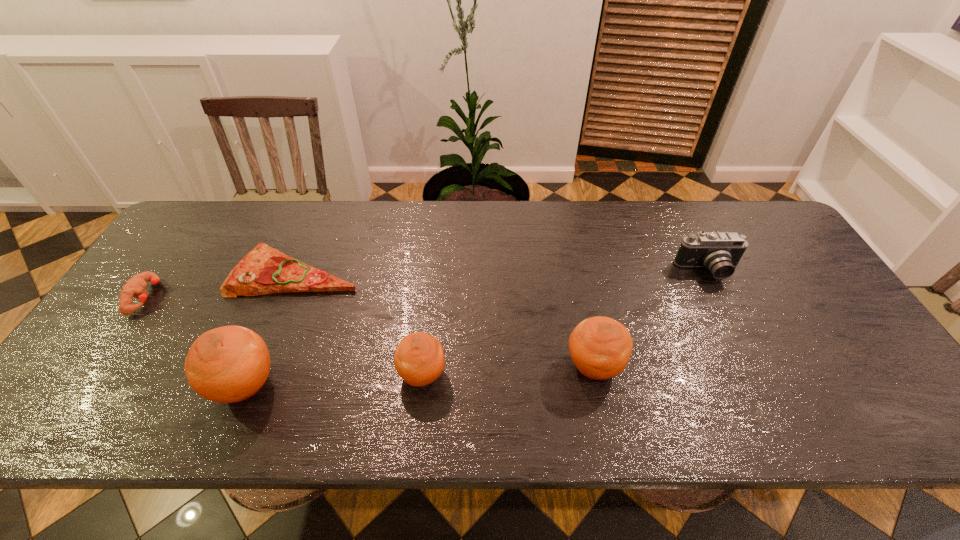
Where is `the leftmost orange`? The image size is (960, 540). the leftmost orange is located at coordinates (229, 364).

The width and height of the screenshot is (960, 540). Identify the location of the fourth object from left to right. (419, 360).

The width and height of the screenshot is (960, 540). I want to click on the second orange from left to right, so click(419, 360).

Image resolution: width=960 pixels, height=540 pixels. I want to click on the fifth shortest object, so click(600, 347).

Identify the location of the second shortest orange. This screenshot has height=540, width=960. pos(600,347).

This screenshot has height=540, width=960. I want to click on puncher, so click(135, 287).

This screenshot has height=540, width=960. Identify the location of the second shortest object. (135, 287).

Where is `the shortest object`? This screenshot has width=960, height=540. the shortest object is located at coordinates (264, 270).

I want to click on the rightmost object, so click(719, 252).

Where is `blank area located on the back of the leftmost orange`? Image resolution: width=960 pixels, height=540 pixels. blank area located on the back of the leftmost orange is located at coordinates (287, 283).